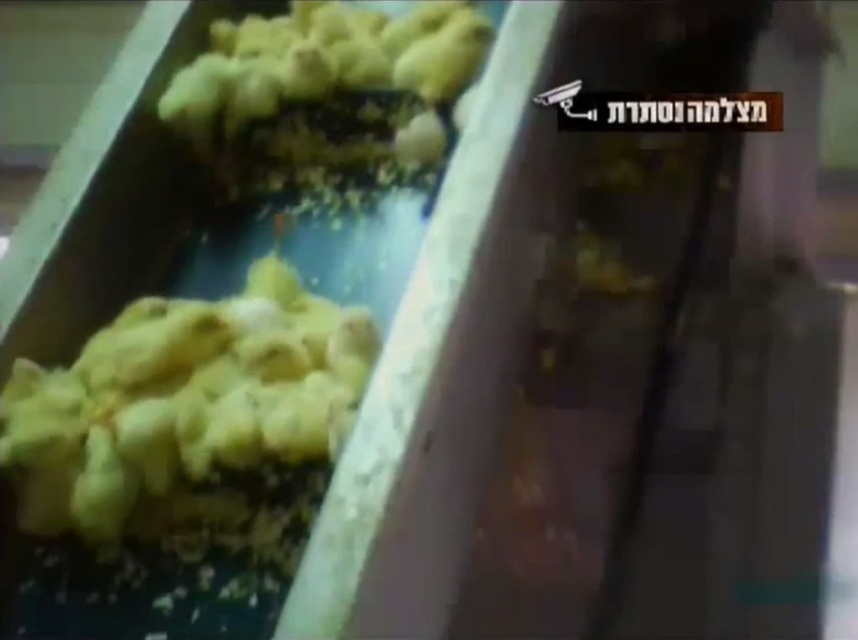
Question: Which object is farther from the camera taking this photo?

Choices:
 (A) yellow matte chicks at left
 (B) yellow matte chicks at upper left

Answer: (B)

Question: Observing the image, what is the correct spatial positioning of yellow matte chicks at left in reference to yellow matte chicks at upper left?

Choices:
 (A) above
 (B) below

Answer: (B)

Question: Which point appears closest to the camera in this image?

Choices:
 (A) (228, 186)
 (B) (162, 432)

Answer: (B)

Question: Which point is closer to the camera taking this photo?

Choices:
 (A) (216, 81)
 (B) (363, 362)

Answer: (B)

Question: Observing the image, what is the correct spatial positioning of yellow matte chicks at left in reference to yellow matte chicks at upper left?

Choices:
 (A) below
 (B) above

Answer: (A)

Question: Can you confirm if yellow matte chicks at left is positioned to the left of yellow matte chicks at upper left?

Choices:
 (A) no
 (B) yes

Answer: (B)